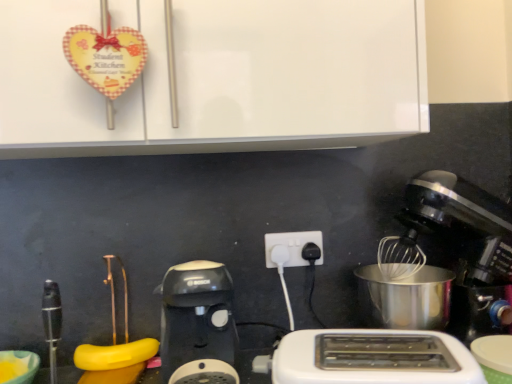
Question: Does white glossy cabinet at upper center have a lesser width compared to white plastic toaster at lower center?

Choices:
 (A) no
 (B) yes

Answer: (A)

Question: From a real-world perspective, is white glossy cabinet at upper center below white plastic toaster at lower center?

Choices:
 (A) yes
 (B) no

Answer: (B)

Question: Does white glossy cabinet at upper center touch white plastic toaster at lower center?

Choices:
 (A) no
 (B) yes

Answer: (A)

Question: Is white glossy cabinet at upper center smaller than white plastic toaster at lower center?

Choices:
 (A) no
 (B) yes

Answer: (A)

Question: From a real-world perspective, is white glossy cabinet at upper center physically above white plastic toaster at lower center?

Choices:
 (A) yes
 (B) no

Answer: (A)

Question: Would you say metallic silver mixer at right is inside or outside white glossy cabinet at upper center?

Choices:
 (A) inside
 (B) outside

Answer: (B)

Question: Is point click(403, 256) positioned closer to the camera than point click(258, 21)?

Choices:
 (A) farther
 (B) closer

Answer: (A)

Question: In the image, is metallic silver mixer at right positioned in front of or behind white glossy cabinet at upper center?

Choices:
 (A) front
 (B) behind

Answer: (B)

Question: Considering the positions of metallic silver mixer at right and white glossy cabinet at upper center in the image, is metallic silver mixer at right taller or shorter than white glossy cabinet at upper center?

Choices:
 (A) tall
 (B) short

Answer: (A)

Question: Is white glossy cabinet at upper center inside or outside of metallic silver mixer at right?

Choices:
 (A) outside
 (B) inside

Answer: (A)

Question: From a real-world perspective, is white glossy cabinet at upper center physically located above or below metallic silver mixer at right?

Choices:
 (A) above
 (B) below

Answer: (A)

Question: From the image's perspective, is white glossy cabinet at upper center located above or below metallic silver mixer at right?

Choices:
 (A) below
 (B) above

Answer: (B)

Question: In the image, is white glossy cabinet at upper center on the left side or the right side of metallic silver mixer at right?

Choices:
 (A) right
 (B) left

Answer: (B)

Question: Looking at the image, does matte yellow bowl at lower left seem bigger or smaller compared to white plastic toaster at lower center?

Choices:
 (A) big
 (B) small

Answer: (B)

Question: From a real-world perspective, is matte yellow bowl at lower left positioned above or below white plastic toaster at lower center?

Choices:
 (A) above
 (B) below

Answer: (B)